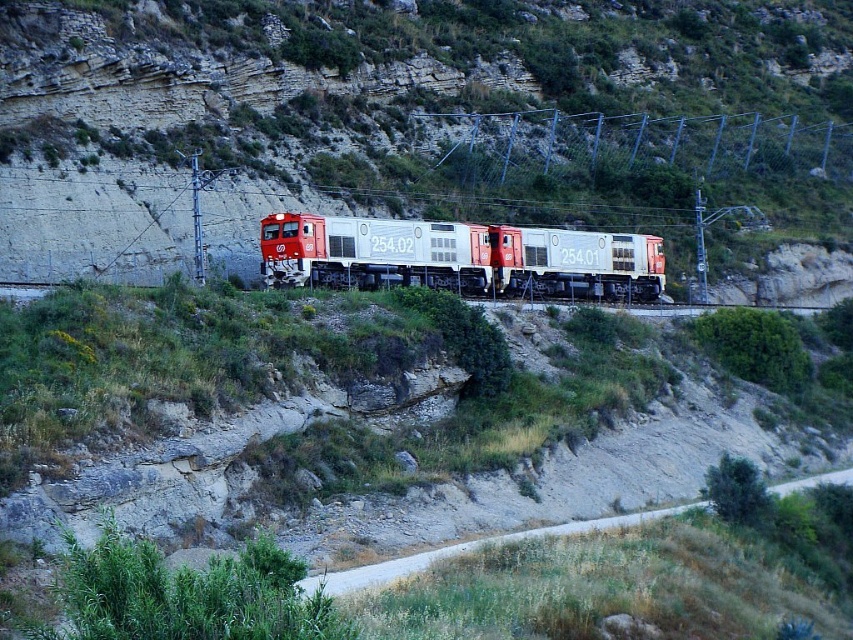
Question: In this image, where is matte white train at center located relative to silver metallic locomotive at center?

Choices:
 (A) above
 (B) below

Answer: (A)

Question: Is matte white train at center bigger than dirt road at lower right?

Choices:
 (A) no
 (B) yes

Answer: (B)

Question: Which object appears farthest from the camera in this image?

Choices:
 (A) red and white locomotive at center
 (B) silver metallic locomotive at center
 (C) matte white train at center
 (D) dirt road at lower right

Answer: (B)

Question: Which point appears closest to the camera in this image?

Choices:
 (A) (326, 573)
 (B) (606, 296)

Answer: (A)

Question: Is matte white train at center to the right of silver metallic locomotive at center from the viewer's perspective?

Choices:
 (A) no
 (B) yes

Answer: (B)

Question: Among these objects, which one is farthest from the camera?

Choices:
 (A) silver metallic locomotive at center
 (B) red and white locomotive at center
 (C) dirt road at lower right

Answer: (A)